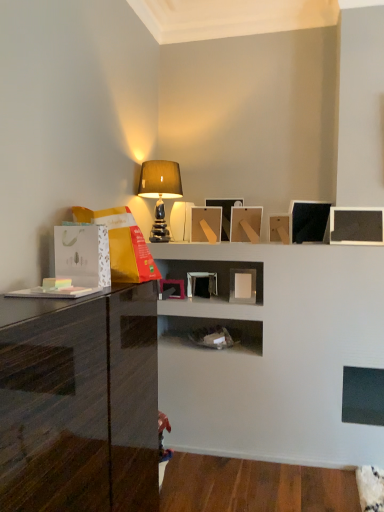
Question: From a real-world perspective, is matte beige lampshade at upper center positioned above or below glossy black cabinet at left?

Choices:
 (A) above
 (B) below

Answer: (A)

Question: Which is correct: matte beige lampshade at upper center is inside glossy black cabinet at left, or outside of it?

Choices:
 (A) outside
 (B) inside

Answer: (A)

Question: Which object is the farthest from the matte beige lampshade at upper center?

Choices:
 (A) matte wood picture frame at center
 (B) glossy black cabinet at left

Answer: (B)

Question: Which is nearer to the glossy black cabinet at left?

Choices:
 (A) matte wood picture frame at center
 (B) matte beige lampshade at upper center

Answer: (B)